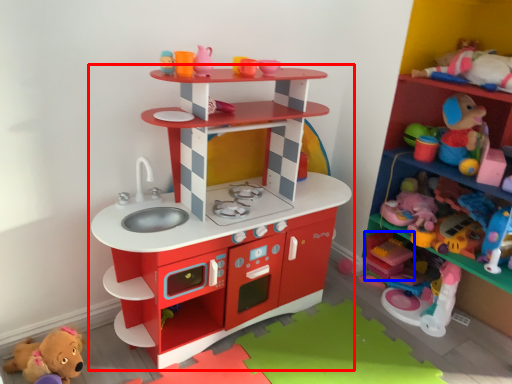
Question: Which object is closer to the camera taking this photo, shelf (highlighted by a red box) or toy (highlighted by a blue box)?

Choices:
 (A) shelf
 (B) toy

Answer: (A)